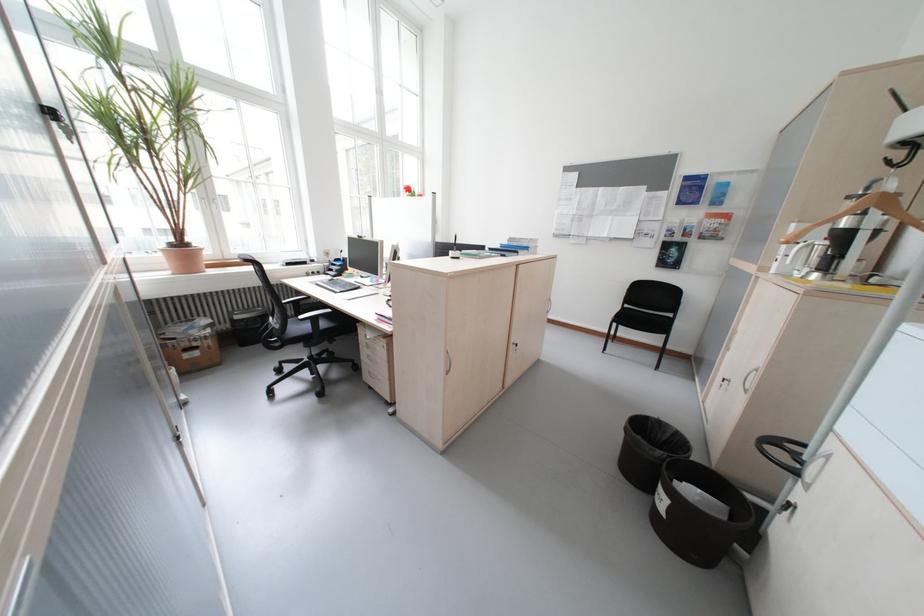
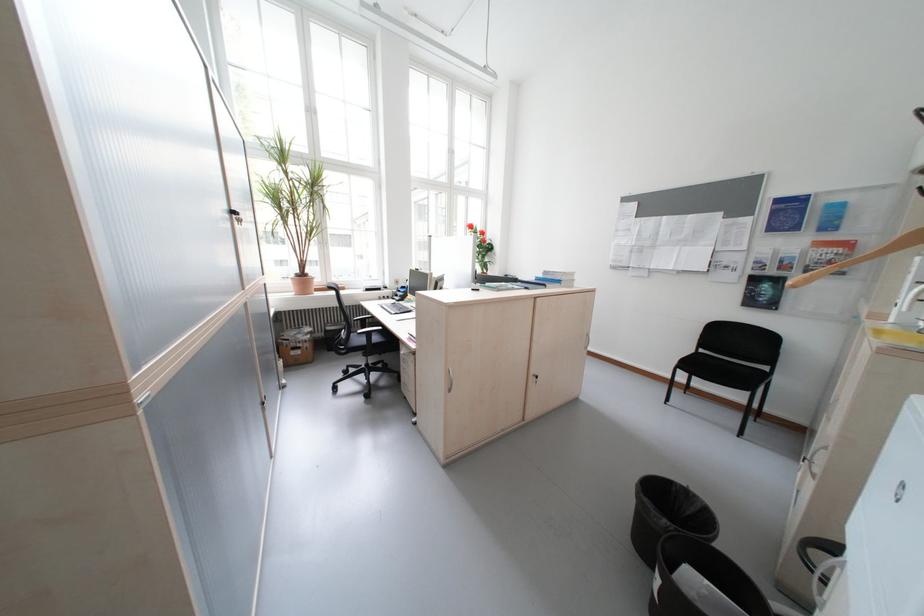
Locate, in the second image, the point that corresponds to point 737,225 in the first image.

(859, 257)